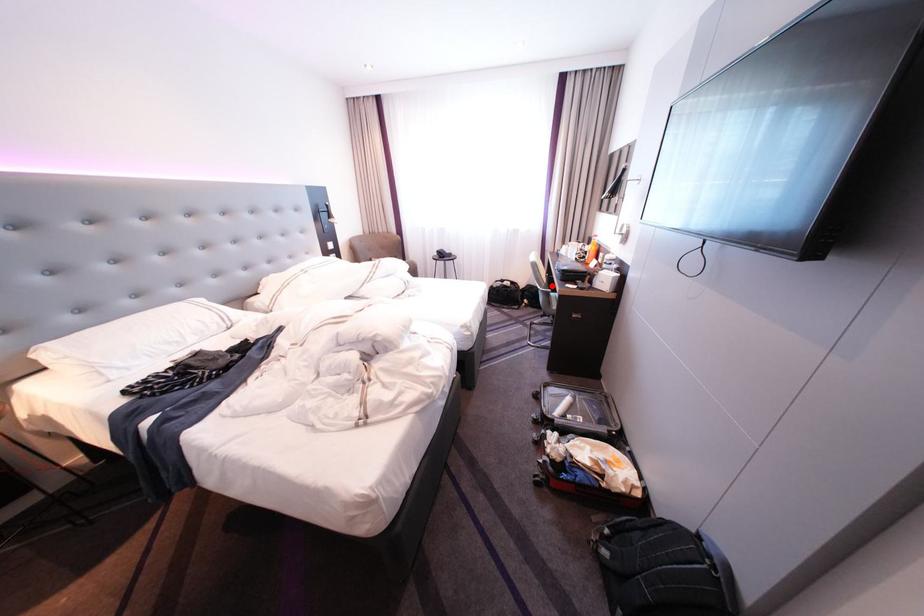
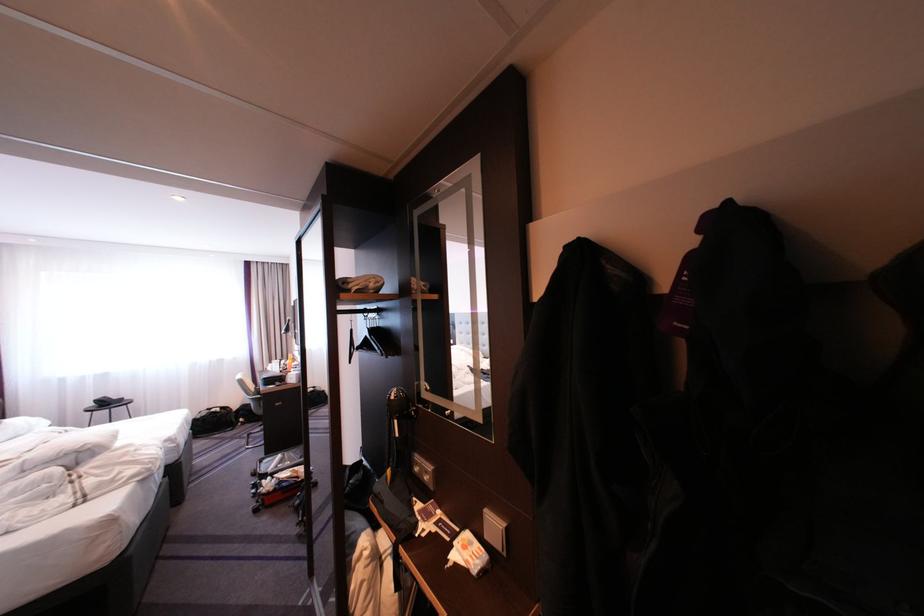
The point at the highlighted location is marked in the first image. Where is the corresponding point in the second image?

(261, 395)